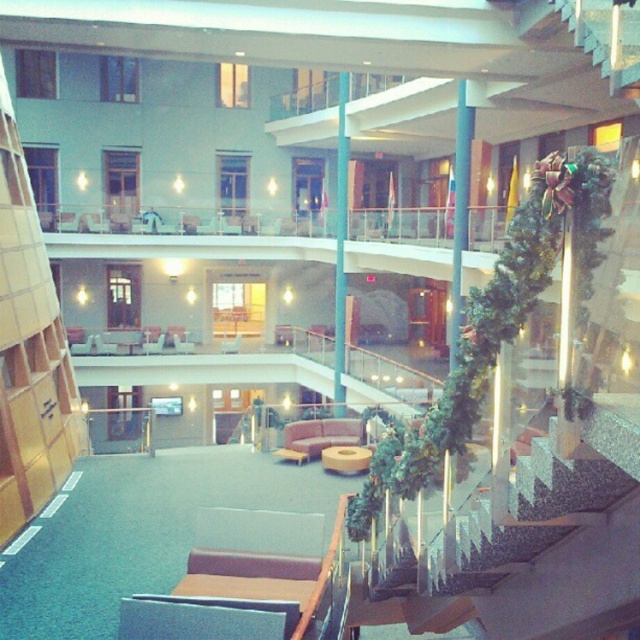
Does blue glossy pillar at center have a greater width compared to matte brown chair at center?

Incorrect, blue glossy pillar at center's width does not surpass matte brown chair at center's.

Can you confirm if blue glossy pillar at center is smaller than matte brown chair at center?

Indeed, blue glossy pillar at center has a smaller size compared to matte brown chair at center.

Who is more distant from viewer, (x=344, y=76) or (x=227, y=342)?

Point (x=227, y=342)

Locate an element on the screen. This screenshot has height=640, width=640. blue glossy pillar at center is located at coordinates (340, 244).